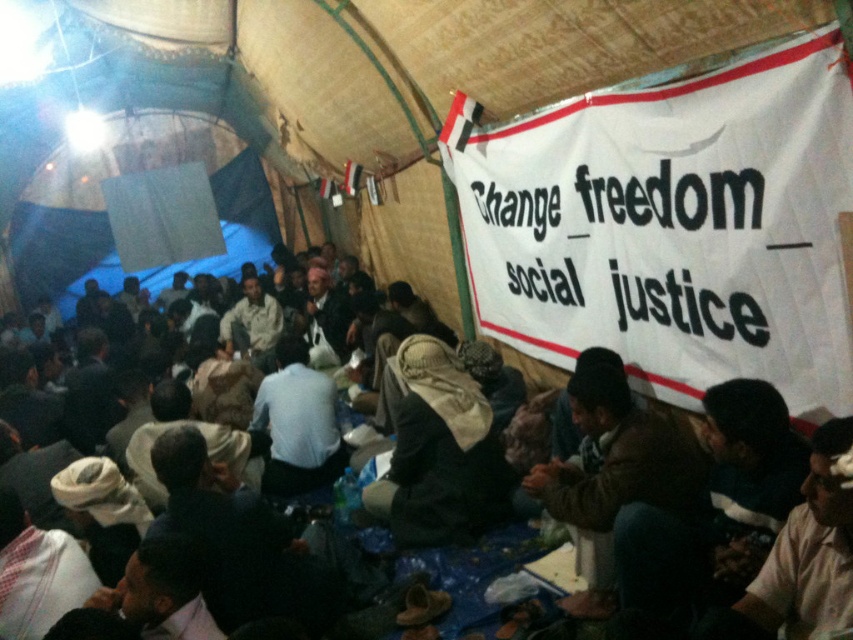
Question: Can you confirm if white textured shirt at lower right is positioned to the left of dark brown leather jacket at center?

Choices:
 (A) no
 (B) yes

Answer: (A)

Question: Among these points, which one is nearest to the camera?

Choices:
 (A) (786, 541)
 (B) (793, 486)

Answer: (A)

Question: Is white textured shirt at lower right to the right of dark brown leather jacket at center from the viewer's perspective?

Choices:
 (A) no
 (B) yes

Answer: (B)

Question: Does white textured shirt at lower right appear over dark brown leather jacket at center?

Choices:
 (A) yes
 (B) no

Answer: (A)

Question: Which point is farther to the camera?

Choices:
 (A) dark brown leather jacket at center
 (B) white textured shirt at lower right

Answer: (A)